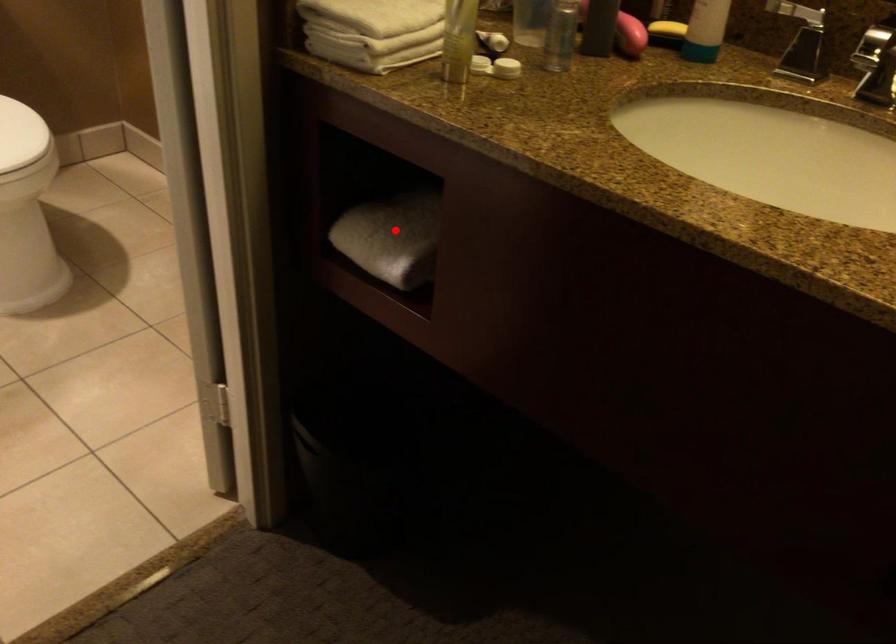
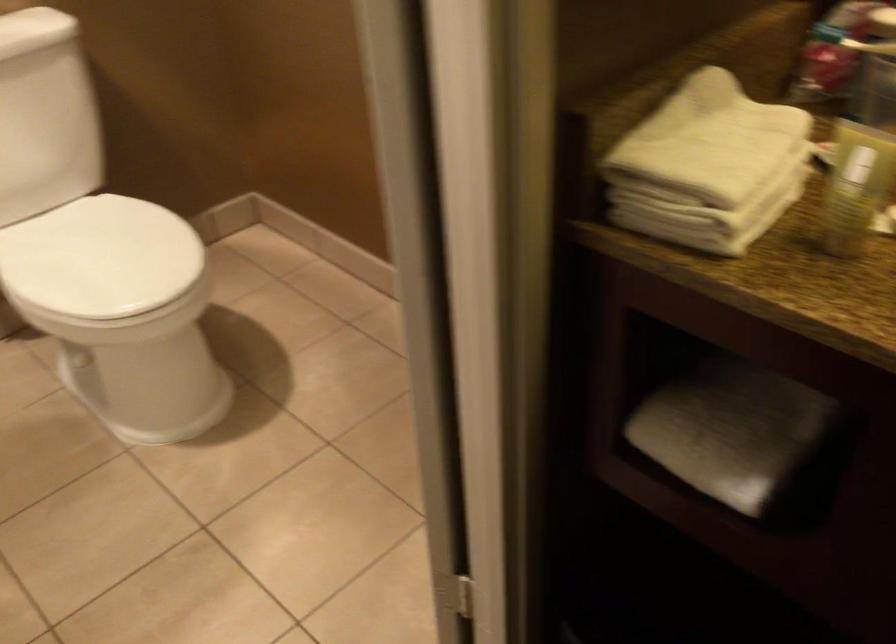
In the second image, find the point that corresponds to the highlighted location in the first image.

(730, 431)